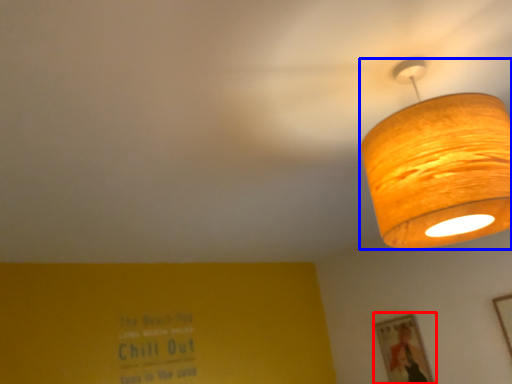
Question: Which object appears farthest to the camera in this image, picture frame (highlighted by a red box) or lamp (highlighted by a blue box)?

Choices:
 (A) picture frame
 (B) lamp

Answer: (A)